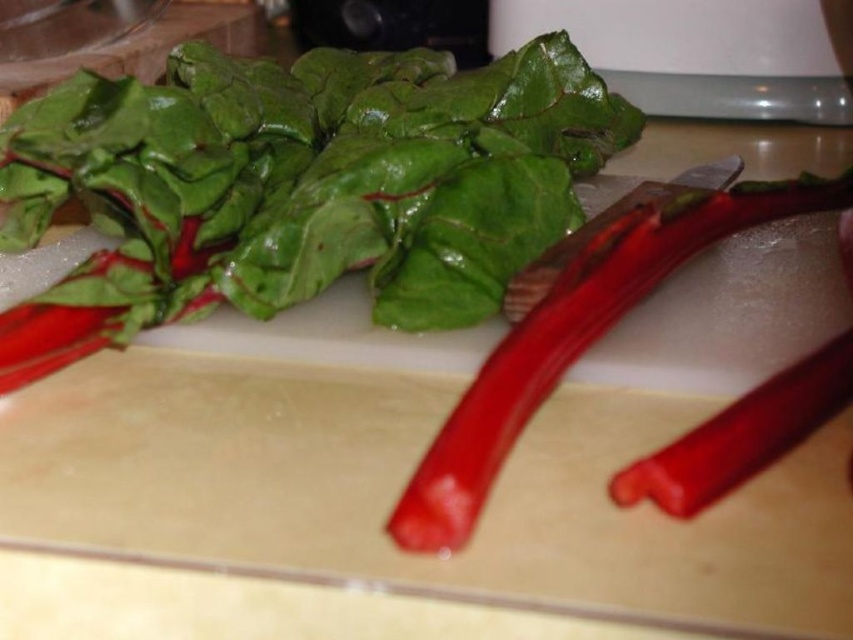
Does beige plastic cutting board at center have a lesser width compared to glossy red rhubarb at upper left?

Yes, beige plastic cutting board at center is thinner than glossy red rhubarb at upper left.

Who is shorter, beige plastic cutting board at center or glossy red rhubarb at upper left?

beige plastic cutting board at center

Who is more forward, (407, 564) or (541, 84)?

Positioned in front is point (407, 564).

The width and height of the screenshot is (853, 640). Find the location of `beige plastic cutting board at center`. beige plastic cutting board at center is located at coordinates (403, 484).

Can you confirm if glossy red rhubarb at upper left is shorter than metallic red knife at center?

In fact, glossy red rhubarb at upper left may be taller than metallic red knife at center.

Is glossy red rhubarb at upper left thinner than metallic red knife at center?

In fact, glossy red rhubarb at upper left might be wider than metallic red knife at center.

Based on the photo, who is more distant from viewer, (144, 292) or (560, 260)?

Positioned behind is point (560, 260).

Where is `glossy red rhubarb at upper left`? This screenshot has width=853, height=640. glossy red rhubarb at upper left is located at coordinates (299, 186).

Between point (231, 282) and point (471, 522), which one is positioned in front?

Point (471, 522) is more forward.

Which is behind, point (47, 140) or point (482, 496)?

The point (47, 140) is behind.

Who is more distant from viewer, (219, 273) or (471, 428)?

The point (219, 273) is more distant.

Where is `glossy red rhubarb at upper left`? The image size is (853, 640). glossy red rhubarb at upper left is located at coordinates (299, 186).